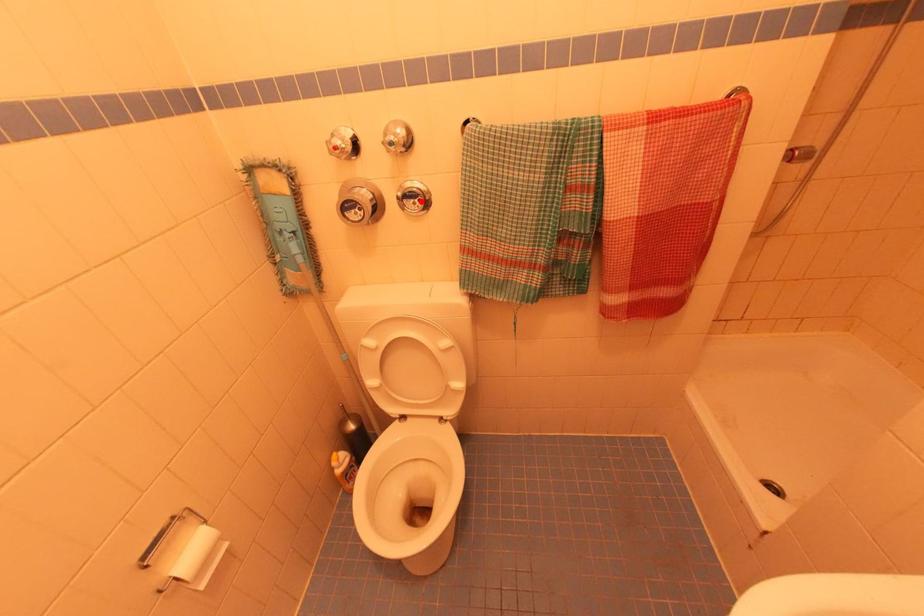
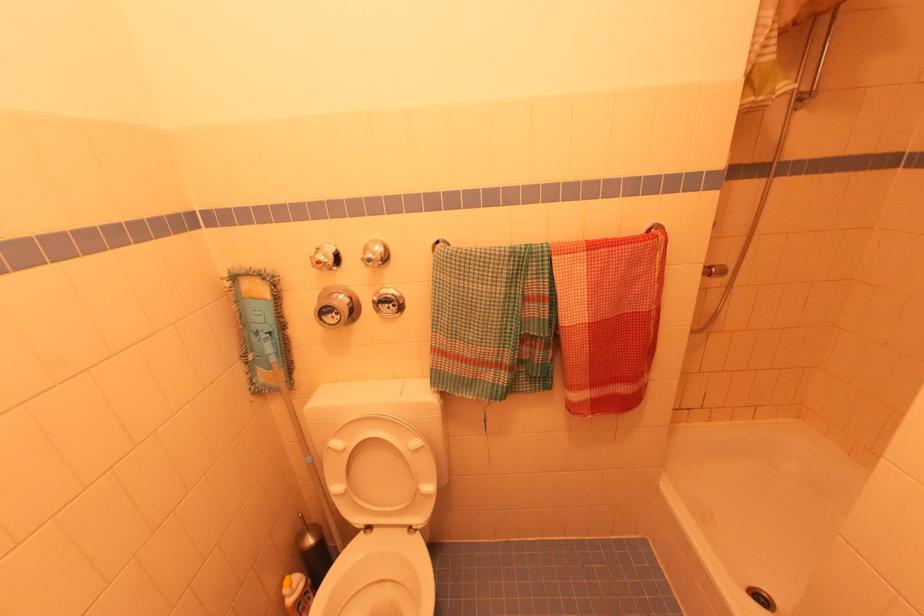
Find the pixel in the second image that matches the highlighted location in the first image.

(395, 306)